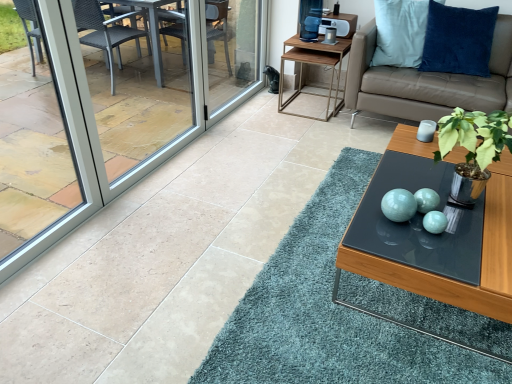
Question: From a real-world perspective, is green leafy plant in metallic pot at center-right positioned above or below wooden side table at upper right?

Choices:
 (A) below
 (B) above

Answer: (B)

Question: In terms of width, does green leafy plant in metallic pot at center-right look wider or thinner when compared to wooden side table at upper right?

Choices:
 (A) thin
 (B) wide

Answer: (A)

Question: Based on their relative distances, which object is farther from the matte glass coffee table at center?

Choices:
 (A) velvet blue pillow at upper right
 (B) clear glass screen door at center, arranged as the 1th screen door when viewed from the right
 (C) transparent glass window at left
 (D) matte turquoise spheres at center
 (E) wooden side table at upper right

Answer: (B)

Question: Which object is positioned closest to the green leafy plant in metallic pot at center-right?

Choices:
 (A) velvet blue pillow at upper right
 (B) transparent glass window at left
 (C) wooden side table at upper right
 (D) beige leather couch at upper right
 (E) matte glass coffee table at center

Answer: (E)